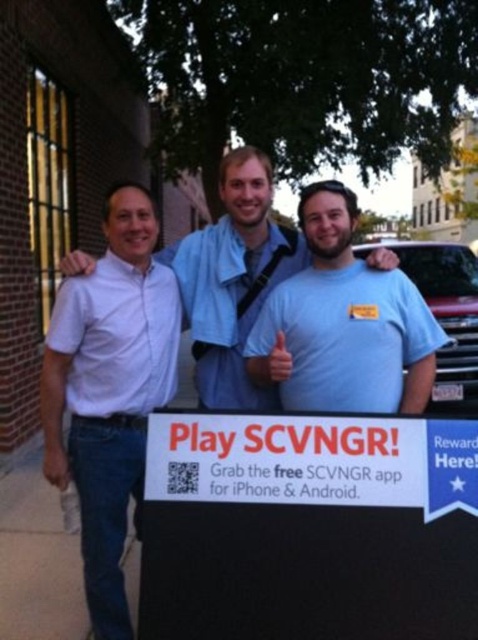
Question: Estimate the real-world distances between objects in this image. Which object is closer to the light blue t-shirt at center?

Choices:
 (A) white shirt at left
 (B) white paper sign at lower center

Answer: (B)

Question: Is white shirt at left further to camera compared to light blue t-shirt at center?

Choices:
 (A) no
 (B) yes

Answer: (B)

Question: Which of the following is the farthest from the observer?

Choices:
 (A) (141, 448)
 (B) (388, 404)
 (C) (283, 266)

Answer: (C)

Question: Is light blue t-shirt at center to the left of blue cotton shirt at center from the viewer's perspective?

Choices:
 (A) yes
 (B) no

Answer: (B)

Question: Which object is the closest to the white paper sign at lower center?

Choices:
 (A) light blue t-shirt at center
 (B) blue cotton shirt at center
 (C) white shirt at left

Answer: (A)

Question: Does white paper sign at lower center have a smaller size compared to blue cotton shirt at center?

Choices:
 (A) yes
 (B) no

Answer: (A)